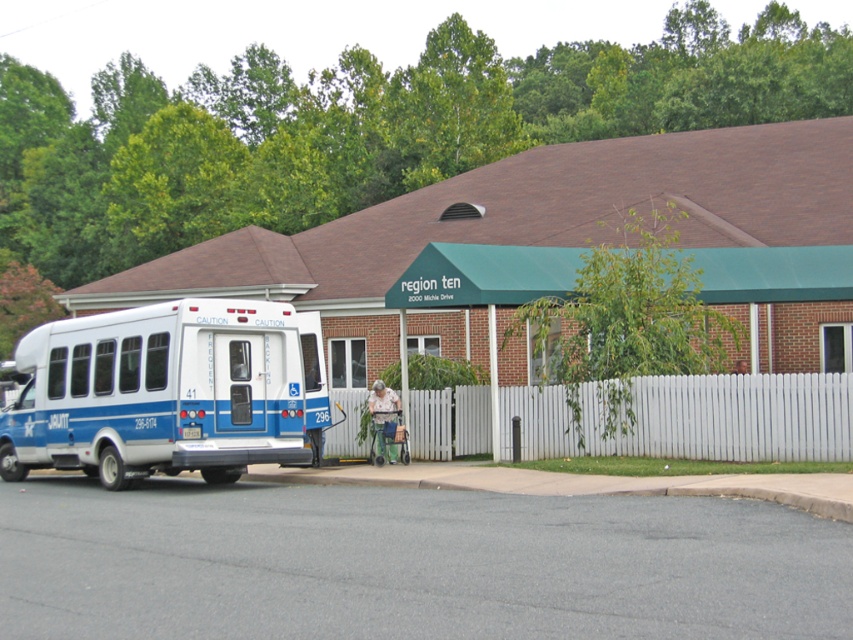
Question: Which object is closer to the camera taking this photo?

Choices:
 (A) white glossy ambulance at left
 (B) white picket fence at center

Answer: (B)

Question: Can you confirm if white glossy ambulance at left is wider than white picket fence at center?

Choices:
 (A) no
 (B) yes

Answer: (A)

Question: Is white glossy ambulance at left smaller than white picket fence at center?

Choices:
 (A) no
 (B) yes

Answer: (B)

Question: In this image, where is white glossy ambulance at left located relative to white picket fence at center?

Choices:
 (A) left
 (B) right

Answer: (A)